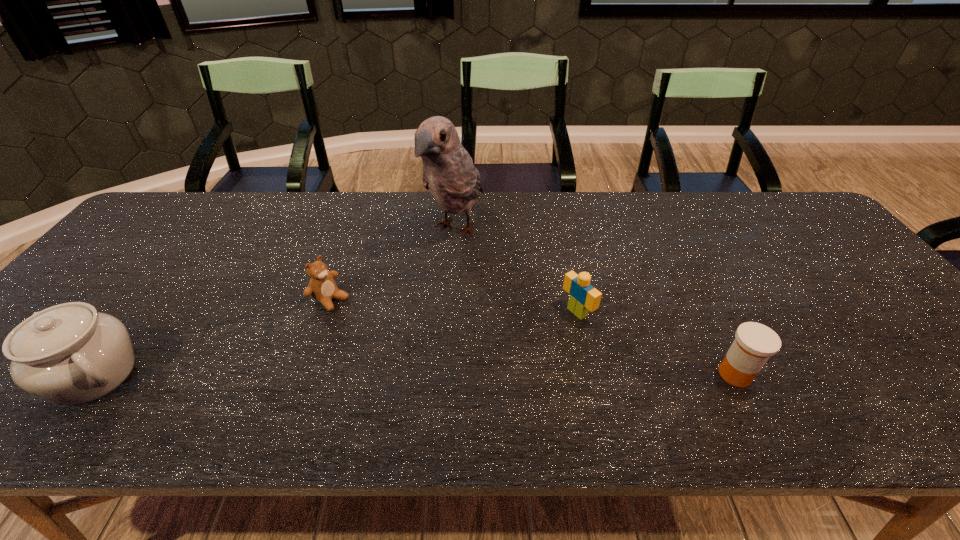
This screenshot has height=540, width=960. In order to click on vacant space on the desktop that is between the leftmost object and the medicine and is positioned on the front-facing side of the teddy bear in this screenshot , I will do `click(450, 375)`.

You are a GUI agent. You are given a task and a screenshot of the screen. Output one action in this format:
    pyautogui.click(x=<x>, y=<y>)
    Task: Click on the free spot on the desktop that is between the chinaware and the medicine and is positioned on the face of the Lego
    This screenshot has width=960, height=540.
    Given the screenshot: What is the action you would take?
    pyautogui.click(x=471, y=375)

Find the location of a particular element. The width and height of the screenshot is (960, 540). free space on the desktop that is between the leftmost object and the rightmost object and is positioned on the front-facing side of the parrot is located at coordinates (337, 375).